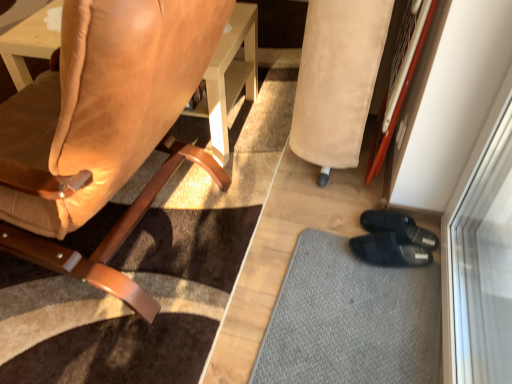
Identify the location of free space behind gray textured mat at lower right. This screenshot has height=384, width=512. (314, 201).